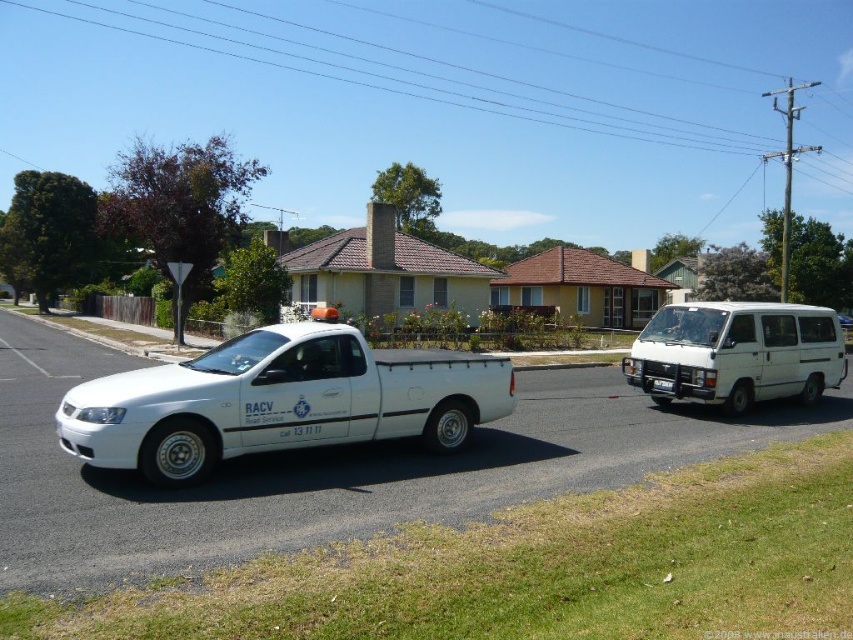
Question: Which point is farther to the camera?

Choices:
 (A) white matte pickup truck at center
 (B) white matte van at right

Answer: (B)

Question: Can you confirm if white matte pickup truck at center is positioned above white matte van at right?

Choices:
 (A) yes
 (B) no

Answer: (B)

Question: Where is white matte pickup truck at center located in relation to white matte van at right in the image?

Choices:
 (A) left
 (B) right

Answer: (A)

Question: Which point is closer to the camera taking this photo?

Choices:
 (A) (631, 346)
 (B) (474, 353)

Answer: (B)

Question: Is white matte pickup truck at center to the right of white matte van at right from the viewer's perspective?

Choices:
 (A) no
 (B) yes

Answer: (A)

Question: Which of the following is the closest to the observer?

Choices:
 (A) white matte van at right
 (B) white matte pickup truck at center

Answer: (B)